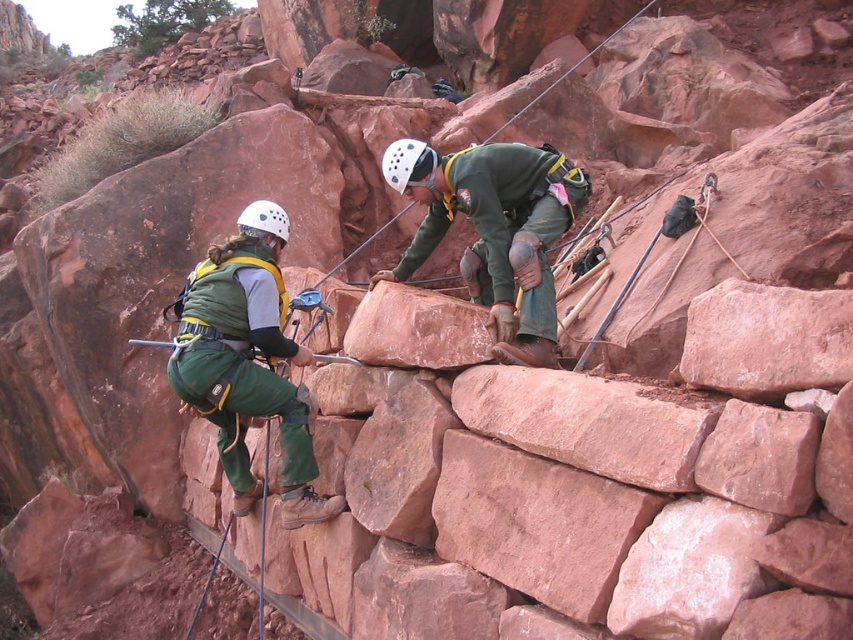
Looking at this image, you are a safety inspector checking the equipment of two climbers on a steep rock face. You notice both climbers have a green fabric harness at center and a green fabric safety vest at center. Which piece of equipment is larger in size?

The green fabric harness at center is bigger than the green fabric safety vest at center.

You are a photographer trying to capture a closeup of the climber on the right. You notice two points marked in the image at coordinates point (418, 172) and point (397, 160). Which point should you focus on to ensure the climber on the right is in focus?

Point (418, 172) is further to the camera than point (397, 160), so focusing on point (418, 172) would ensure the climber on the right is in focus.

You are a safety inspector checking the distance between the green fabric climbing harness at center and the white matte helmet at center. The safety regulation requires a minimum of 10 feet between them. Is the current distance compliant with the regulation?

The green fabric climbing harness at center and the white matte helmet at center are 9.29 feet apart from each other, which is less than the required 10 feet. Therefore, it does not comply with the safety regulation.